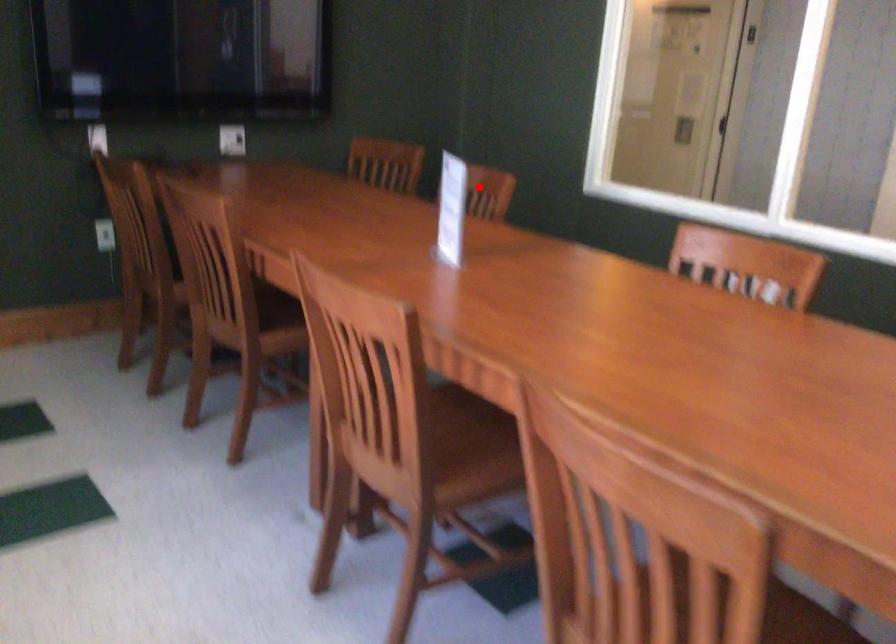
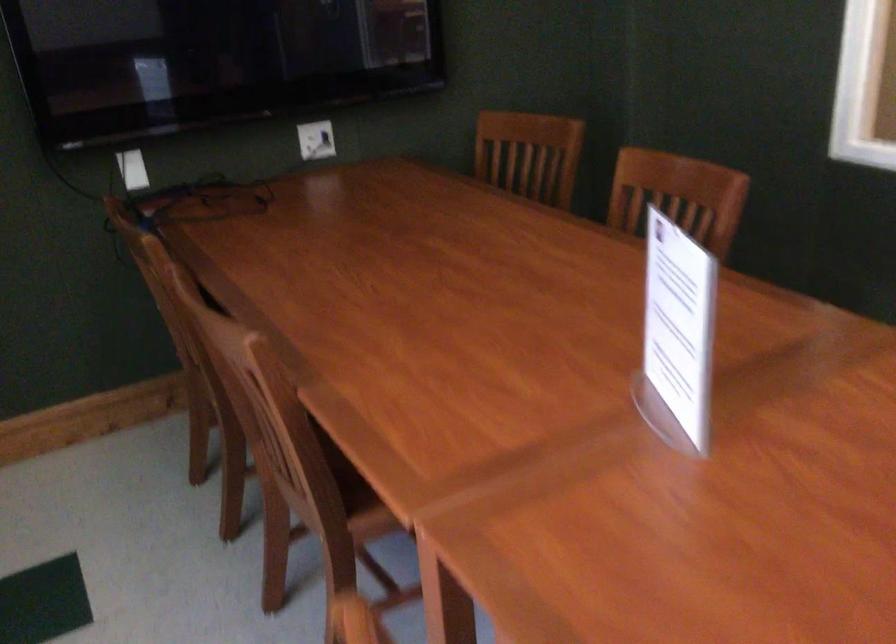
Question: I am providing you with two images of the same scene from different viewpoints. In image1, a red point is highlighted. Considering the same 3D point in image2, which of the following is correct?

Choices:
 (A) It is closer
 (B) It is farther

Answer: (A)